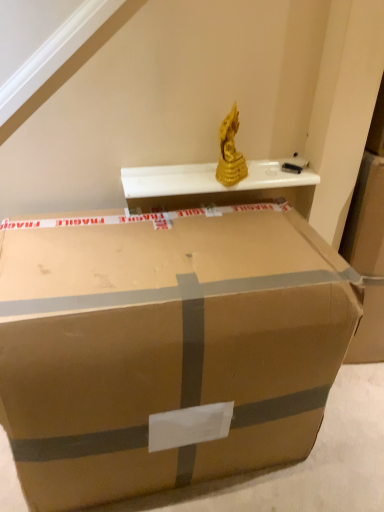
Image resolution: width=384 pixels, height=512 pixels. What do you see at coordinates (165, 345) in the screenshot?
I see `brown cardboard box at center` at bounding box center [165, 345].

Image resolution: width=384 pixels, height=512 pixels. What are the coordinates of `brown cardboard box at center` in the screenshot? It's located at (165, 345).

What do you see at coordinates (215, 186) in the screenshot? Image resolution: width=384 pixels, height=512 pixels. I see `white glossy shelf at upper center` at bounding box center [215, 186].

Image resolution: width=384 pixels, height=512 pixels. Find the location of `white glossy shelf at upper center`. white glossy shelf at upper center is located at coordinates (215, 186).

At what (x,y) coordinates should I click in order to perform the action: click on brown cardboard box at center. Please return your answer as a coordinate pair (x, y). The height and width of the screenshot is (512, 384). Looking at the image, I should click on (165, 345).

Considering the relative positions of brown cardboard box at center and white glossy shelf at upper center in the image provided, is brown cardboard box at center to the left of white glossy shelf at upper center from the viewer's perspective?

Yes, brown cardboard box at center is to the left of white glossy shelf at upper center.

Is the position of brown cardboard box at center less distant than that of white glossy shelf at upper center?

Yes.

Is point (294, 266) closer to viewer compared to point (265, 172)?

Yes.

From the image's perspective, who appears lower, brown cardboard box at center or white glossy shelf at upper center?

brown cardboard box at center, from the image's perspective.

From a real-world perspective, which object rests below the other?

brown cardboard box at center is physically lower.

Can you confirm if brown cardboard box at center is thinner than white glossy shelf at upper center?

No.

Can you confirm if brown cardboard box at center is shorter than white glossy shelf at upper center?

No, brown cardboard box at center is not shorter than white glossy shelf at upper center.

Based on their sizes in the image, would you say brown cardboard box at center is bigger or smaller than white glossy shelf at upper center?

In the image, brown cardboard box at center appears to be larger than white glossy shelf at upper center.

Is brown cardboard box at center outside of white glossy shelf at upper center?

Yes.

Would you say brown cardboard box at center is a long distance from white glossy shelf at upper center?

No, brown cardboard box at center is not far away from white glossy shelf at upper center.

Does brown cardboard box at center turn towards white glossy shelf at upper center?

No.

How different are the orientations of brown cardboard box at center and white glossy shelf at upper center in degrees?

1.2 degrees.

How much distance is there between brown cardboard box at center and white glossy shelf at upper center?

15.45 inches.

Identify the location of table above the brown cardboard box at center (from the image's perspective). (215, 186).

Consider the image. Between white glossy shelf at upper center and brown cardboard box at center, which one appears on the left side from the viewer's perspective?

From the viewer's perspective, brown cardboard box at center appears more on the left side.

Which object is further away from the camera, white glossy shelf at upper center or brown cardboard box at center?

white glossy shelf at upper center is further from the camera.

Which point is more distant from viewer, (x=192, y=193) or (x=290, y=418)?

Positioned behind is point (x=192, y=193).

From the image's perspective, does white glossy shelf at upper center appear higher than brown cardboard box at center?

Yes, from the image's perspective, white glossy shelf at upper center is above brown cardboard box at center.

From a real-world perspective, which object rests below the other?

brown cardboard box at center.

Consider the image. Does white glossy shelf at upper center have a greater width compared to brown cardboard box at center?

Incorrect, the width of white glossy shelf at upper center does not surpass that of brown cardboard box at center.

Is white glossy shelf at upper center taller than brown cardboard box at center?

No, white glossy shelf at upper center is not taller than brown cardboard box at center.

Is white glossy shelf at upper center smaller than brown cardboard box at center?

Indeed, white glossy shelf at upper center has a smaller size compared to brown cardboard box at center.

Choose the correct answer: Is white glossy shelf at upper center inside brown cardboard box at center or outside it?

The correct answer is: outside.

Is white glossy shelf at upper center directly adjacent to brown cardboard box at center?

No, white glossy shelf at upper center is not beside brown cardboard box at center.

Is white glossy shelf at upper center facing away from brown cardboard box at center?

white glossy shelf at upper center does not have its back to brown cardboard box at center.

This screenshot has height=512, width=384. I want to click on table that is above the brown cardboard box at center (from a real-world perspective), so click(x=215, y=186).

I want to click on table on the right of brown cardboard box at center, so click(x=215, y=186).

Image resolution: width=384 pixels, height=512 pixels. Find the location of `table behind the brown cardboard box at center`. table behind the brown cardboard box at center is located at coordinates (215, 186).